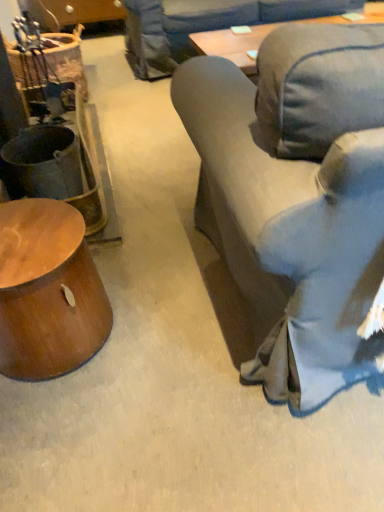
Find the location of a particular element. vacant space that is in between denim fabric couch at right and shiny brown wood side table at lower left is located at coordinates (153, 322).